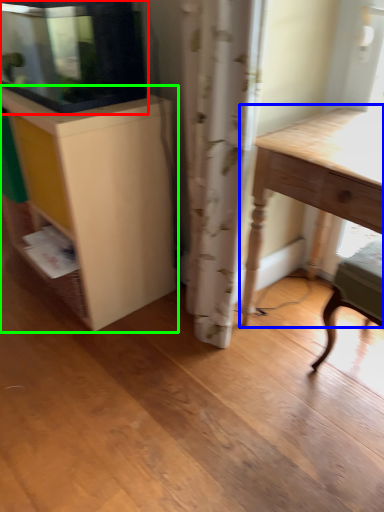
Question: Which object is positioned farthest from cabinetry (highlighted by a red box)? Select from table (highlighted by a blue box) and cabinetry (highlighted by a green box).

Choices:
 (A) table
 (B) cabinetry

Answer: (A)